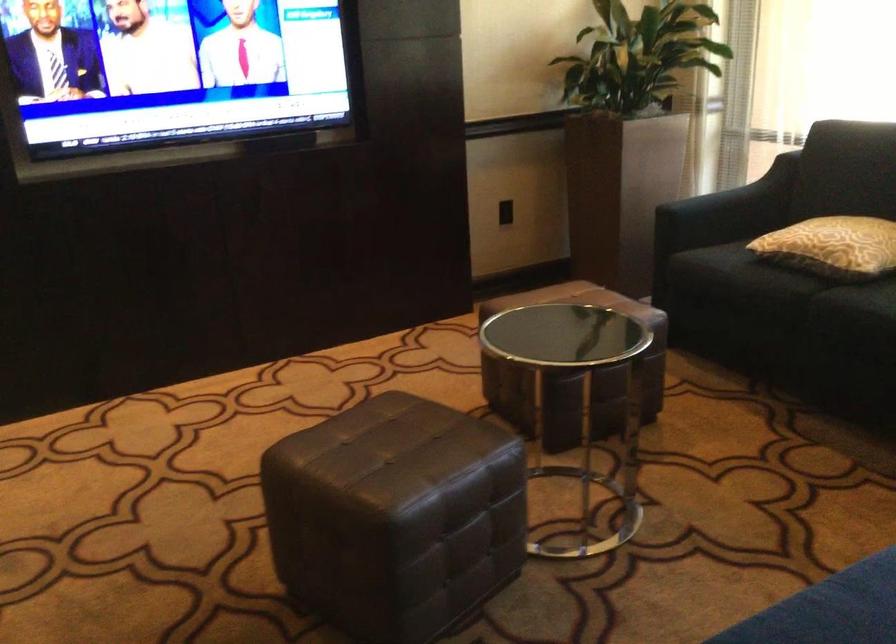
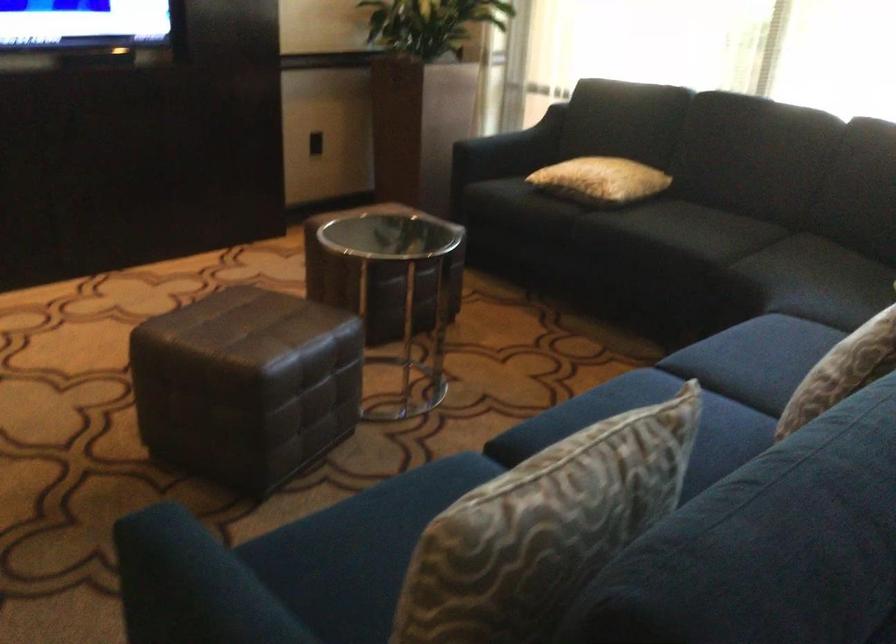
Question: The first image is from the beginning of the video and the second image is from the end. How did the camera likely rotate when shooting the video?

Choices:
 (A) Left
 (B) Right
 (C) Up
 (D) Down

Answer: (B)